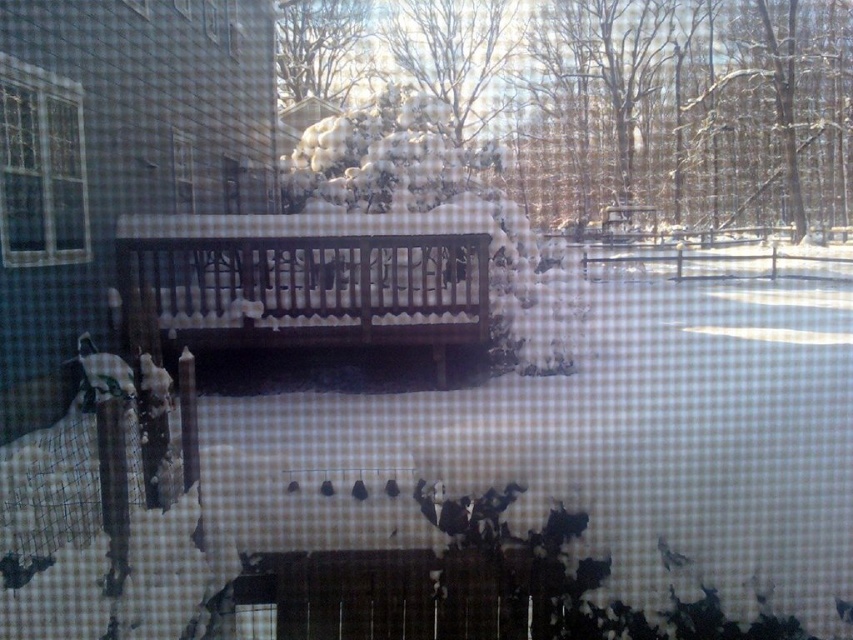
Question: Among these objects, which one is nearest to the camera?

Choices:
 (A) dark brown wood bench at center
 (B) brown wooden rail at center

Answer: (A)

Question: Which point is closer to the camera taking this photo?

Choices:
 (A) (82, 179)
 (B) (367, 289)
 (C) (592, 275)

Answer: (A)

Question: Which object is positioned farthest from the dark brown wood bench at center?

Choices:
 (A) brown wooden rail at center
 (B) white fluffy snow at upper center
 (C) clear glass window at upper left

Answer: (B)

Question: Can you confirm if white fluffy snow at upper center is positioned to the right of brown wooden rail at center?

Choices:
 (A) no
 (B) yes

Answer: (A)

Question: Is white fluffy snow at upper center in front of clear glass window at upper left?

Choices:
 (A) no
 (B) yes

Answer: (A)

Question: Does white fluffy snow at upper center appear under brown wooden rail at center?

Choices:
 (A) yes
 (B) no

Answer: (B)